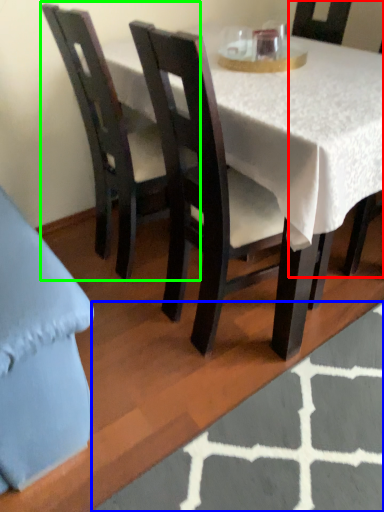
Question: Which object is the closest to the chair (highlighted by a red box)? Choose among these: place mat (highlighted by a blue box) or chair (highlighted by a green box).

Choices:
 (A) place mat
 (B) chair

Answer: (B)